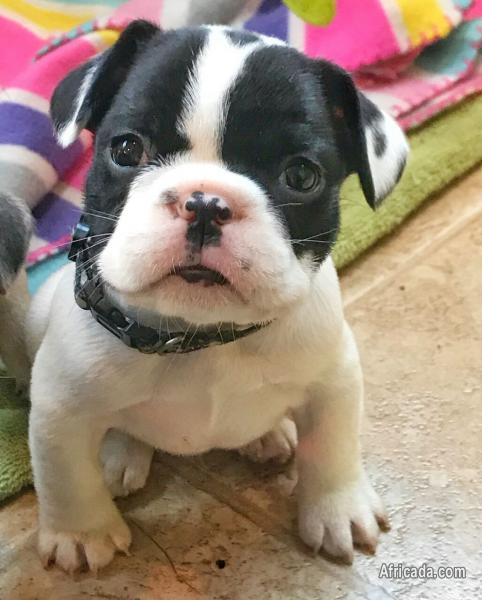
The width and height of the screenshot is (482, 600). What are the coordinates of `floor` in the screenshot? It's located at (243, 535).